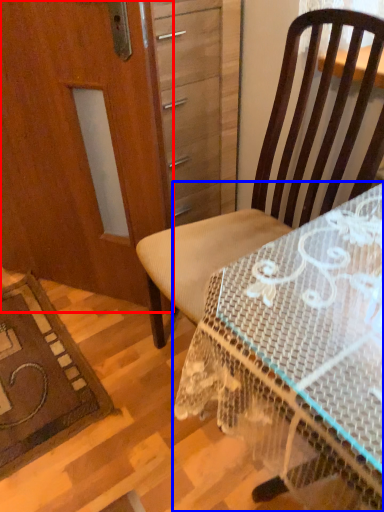
Question: Which point is further to the camera, screen door (highlighted by a red box) or desk (highlighted by a blue box)?

Choices:
 (A) screen door
 (B) desk

Answer: (A)